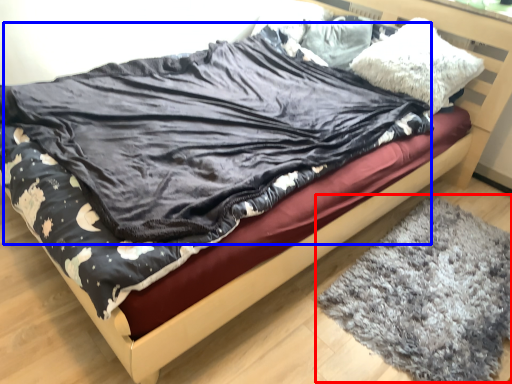
Question: Which of the following is the farthest to the observer, mat (highlighted by a red box) or blanket (highlighted by a blue box)?

Choices:
 (A) mat
 (B) blanket

Answer: (A)